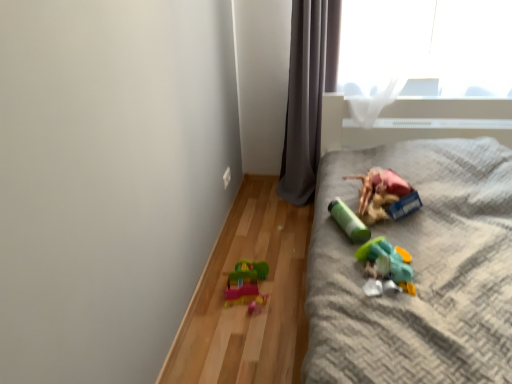
In order to click on vacant space that is to the left of gray fabric curtain at upper center in this screenshot , I will do `click(259, 199)`.